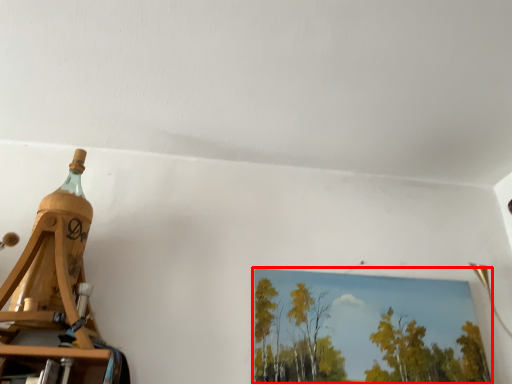
Question: In this image, where is picture frame (annotated by the red box) located relative to bottle?

Choices:
 (A) left
 (B) right

Answer: (B)